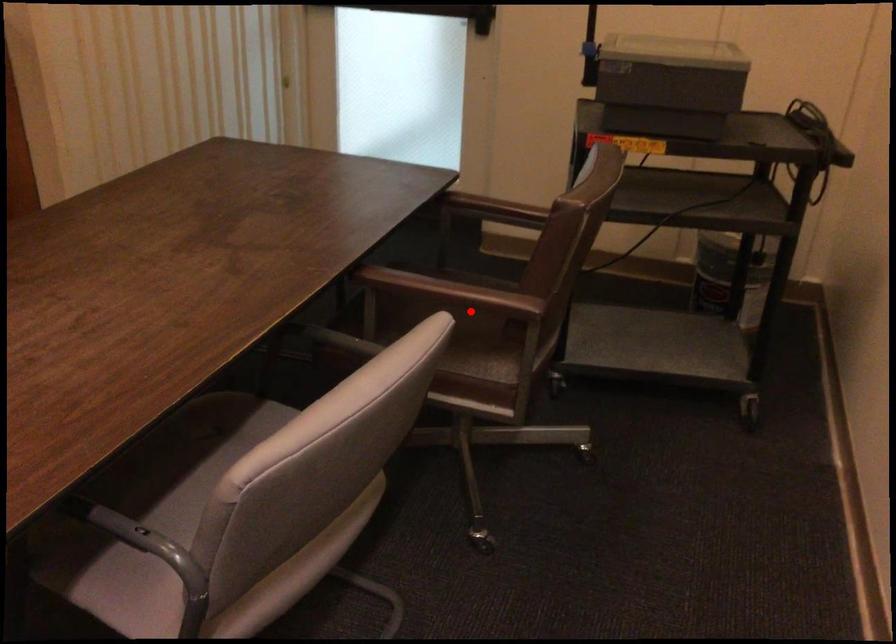
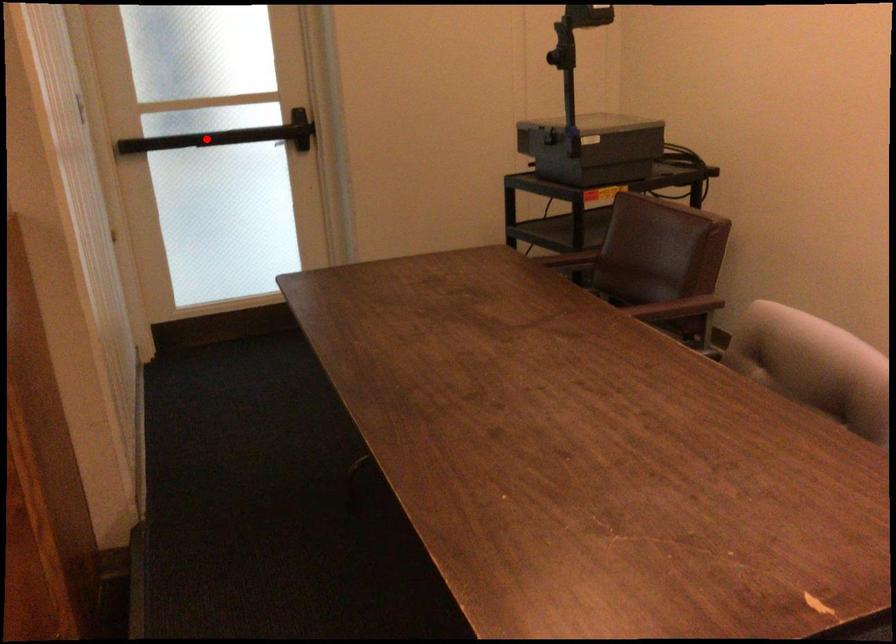
I am providing you with two images of the same scene from different viewpoints. A red point is marked on the first image and another point is marked on the second image. Is the marked point in image1 the same physical position as the marked point in image2?

No